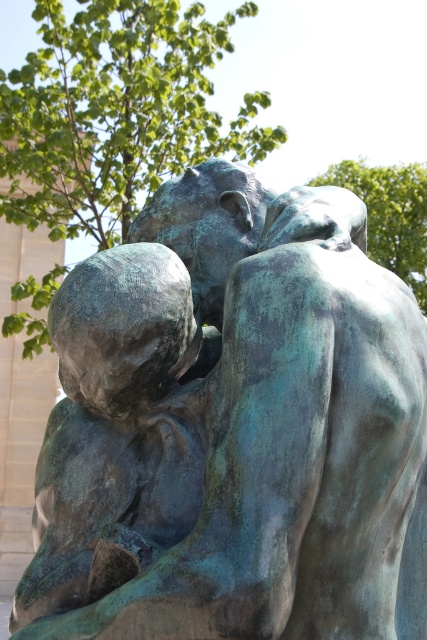
You are an art conservator assessing the placement of the green patina bronze statue at center. Based on its coordinates, is the statue positioned closer to the left or right side of the image?

The green patina bronze statue at center is positioned closer to the right side of the image since its x coordinate is 0.670, which is closer to 1.0 than 0.0.

You are an art conservator assessing the space in a new museum exhibit. The exhibit requires that the green patina bronze statue at center must be the focal point, taking up more visual space than the green leafy tree at upper center. Based on the current arrangement, is this requirement met?

The green patina bronze statue at center occupies less space than the green leafy tree at upper center, so the requirement is not met as the statue does not take up more visual space than the tree.